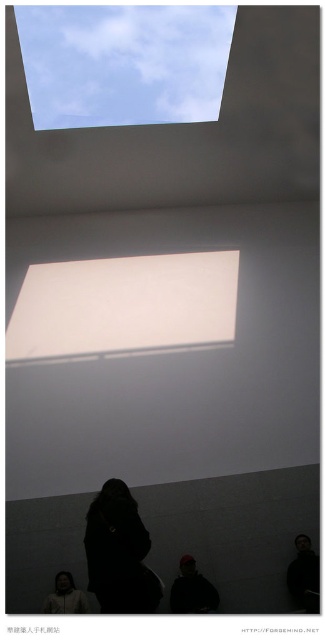
Question: Is dark hair at lower right to the right of white matte jacket at lower left from the viewer's perspective?

Choices:
 (A) no
 (B) yes

Answer: (B)

Question: Is black matte person at lower center smaller than dark hair at lower right?

Choices:
 (A) no
 (B) yes

Answer: (A)

Question: Is transparent glass window at upper center to the right of black matte person at lower center from the viewer's perspective?

Choices:
 (A) no
 (B) yes

Answer: (B)

Question: Estimate the real-world distances between objects in this image. Which object is farther from the dark gray hoodie at lower center?

Choices:
 (A) white matte rectangular at upper center
 (B) dark hair at lower right
 (C) black matte person at lower center

Answer: (A)

Question: Among these objects, which one is nearest to the camera?

Choices:
 (A) black matte person at lower center
 (B) white matte jacket at lower left
 (C) white matte rectangular at upper center

Answer: (A)

Question: Among these points, which one is farthest from the camera?

Choices:
 (A) (119, 547)
 (B) (197, 589)

Answer: (B)